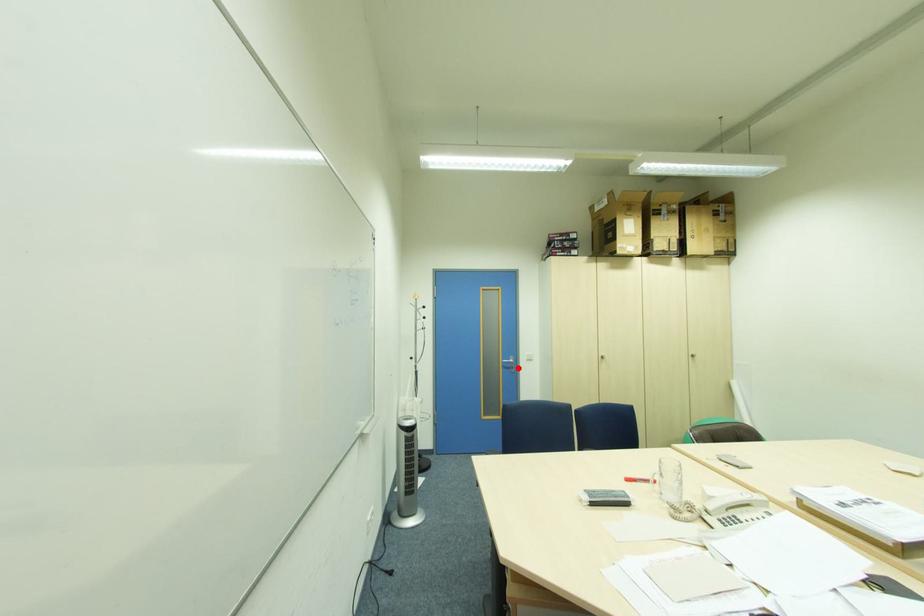
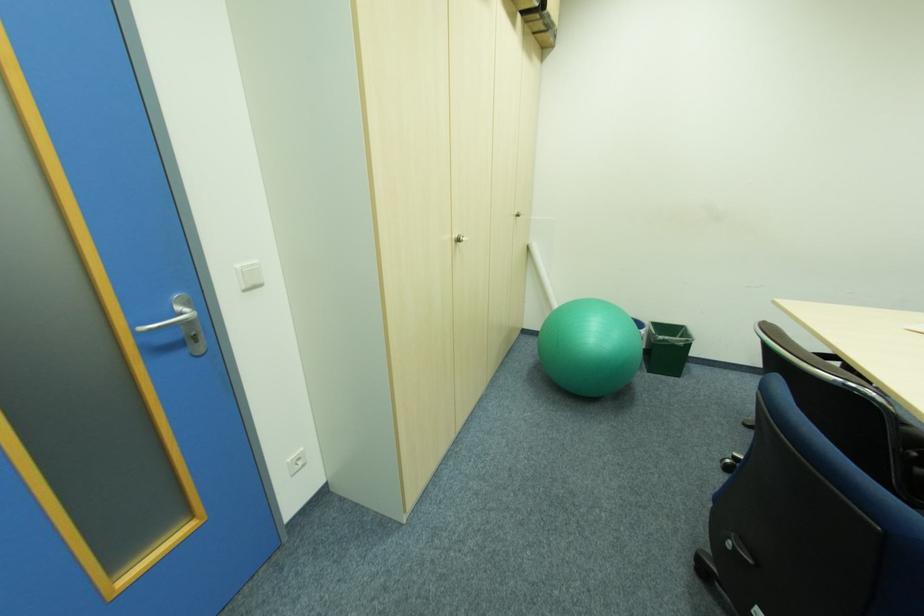
Question: I am providing you with two images of the same scene from different viewpoints. Given a red point in image1, look at the same physical point in image2. Is it:

Choices:
 (A) Closer to the viewpoint
 (B) Farther from the viewpoint

Answer: (A)